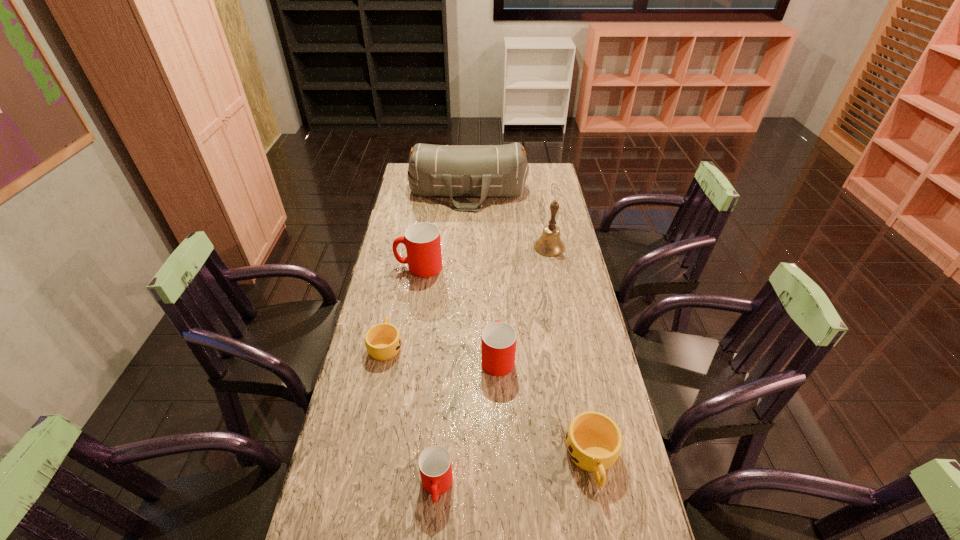
Find the location of `the third closest red cup relative to the duffel bag`. the third closest red cup relative to the duffel bag is located at coordinates (435, 466).

Point out which red cup is positioned as the nearest to the tallest cup. Please provide its 2D coordinates. Your answer should be formatted as a tuple, i.e. [(x, y)], where the tuple contains the x and y coordinates of a point satisfying the conditions above.

[(498, 339)]

What are the coordinates of `beige cup that is the closest to the nearest red cup` in the screenshot? It's located at (593, 440).

Choose which beige cup is the second nearest neighbor to the duffel bag. Please provide its 2D coordinates. Your answer should be formatted as a tuple, i.e. [(x, y)], where the tuple contains the x and y coordinates of a point satisfying the conditions above.

[(593, 440)]

Find the location of `vacant space that satisfies the following two spatial constraints: 1. on the side of the bell with the handle; 2. on the left side of the fifth shortest object`. vacant space that satisfies the following two spatial constraints: 1. on the side of the bell with the handle; 2. on the left side of the fifth shortest object is located at coordinates (422, 247).

Find the location of a particular element. vacant region that satisfies the following two spatial constraints: 1. on the side of the leftmost red cup with the handle; 2. on the back side of the farthest object is located at coordinates (431, 193).